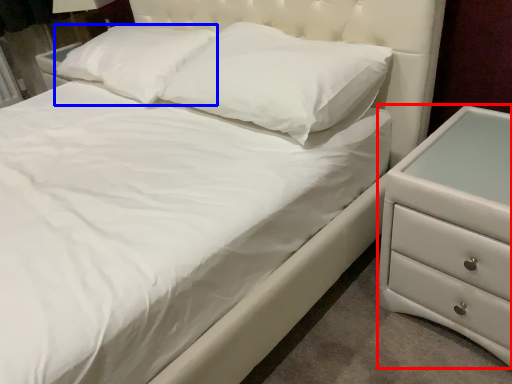
Question: Which point is closer to the camera, chest of drawers (highlighted by a red box) or pillow (highlighted by a blue box)?

Choices:
 (A) chest of drawers
 (B) pillow

Answer: (A)